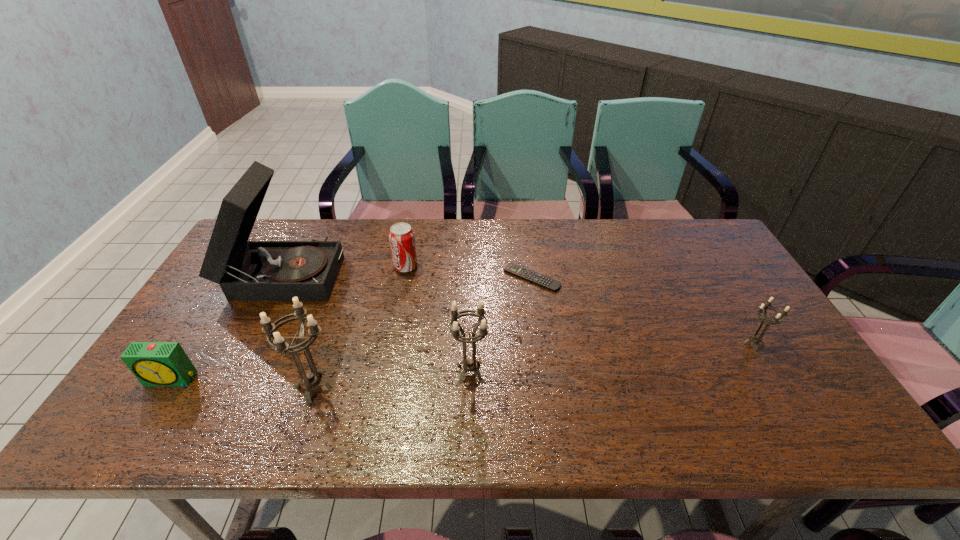
This screenshot has width=960, height=540. I want to click on the leftmost candle holder, so click(311, 379).

Image resolution: width=960 pixels, height=540 pixels. Find the location of `the second shortest candle holder`. the second shortest candle holder is located at coordinates (469, 365).

Locate an element on the screen. This screenshot has height=540, width=960. the third tallest object is located at coordinates (469, 365).

At what (x,y) coordinates should I click in order to perform the action: click on the shortest candle holder. Please return your answer as a coordinate pair (x, y). The height and width of the screenshot is (540, 960). Looking at the image, I should click on click(756, 339).

Locate an element on the screen. the rightmost candle holder is located at coordinates (756, 339).

The width and height of the screenshot is (960, 540). I want to click on soda can, so click(x=401, y=236).

Locate an element on the screen. The width and height of the screenshot is (960, 540). phonograph_record is located at coordinates (246, 270).

Where is `alarm clock`? alarm clock is located at coordinates (153, 363).

Identify the location of the shortest object. The width and height of the screenshot is (960, 540). (545, 282).

Find the location of a particular element. remote control is located at coordinates (545, 282).